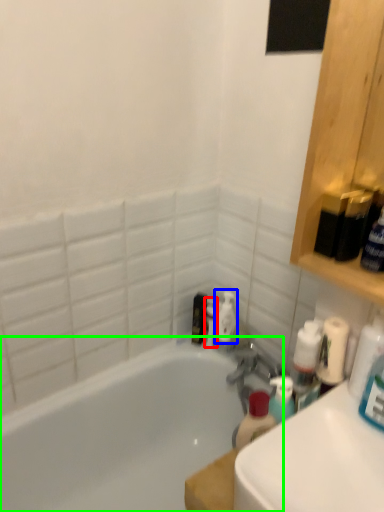
Question: Considering the real-world distances, which object is farthest from toiletry (highlighted by a red box)? cleaning product (highlighted by a blue box) or bathtub (highlighted by a green box)?

Choices:
 (A) cleaning product
 (B) bathtub

Answer: (B)